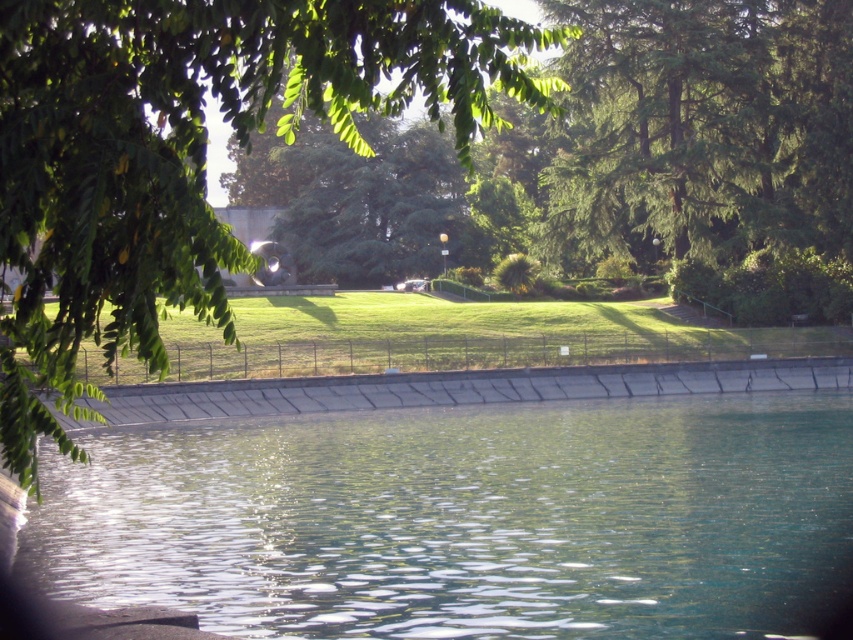
Question: Does green leafy tree at upper left appear over green grass at center?

Choices:
 (A) yes
 (B) no

Answer: (A)

Question: Which point is farther to the camera?

Choices:
 (A) clear glass water at lower center
 (B) green leafy tree at upper left

Answer: (A)

Question: Can you confirm if clear glass water at lower center is thinner than green grass at center?

Choices:
 (A) no
 (B) yes

Answer: (B)

Question: Which is farther from the green leafy tree at upper left?

Choices:
 (A) green grass at center
 (B) clear glass water at lower center

Answer: (A)

Question: Considering the real-world distances, which object is farthest from the green leafy tree at upper left?

Choices:
 (A) green grass at center
 (B) clear glass water at lower center

Answer: (A)

Question: Does green leafy tree at upper left appear on the right side of green grass at center?

Choices:
 (A) yes
 (B) no

Answer: (B)